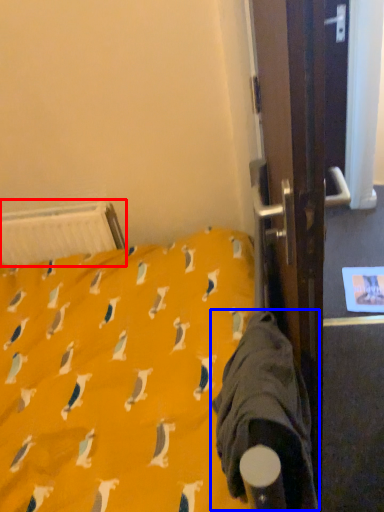
Question: Which object appears closest to the camera in this image, radiator (highlighted by a red box) or sleeping bag (highlighted by a blue box)?

Choices:
 (A) radiator
 (B) sleeping bag

Answer: (B)